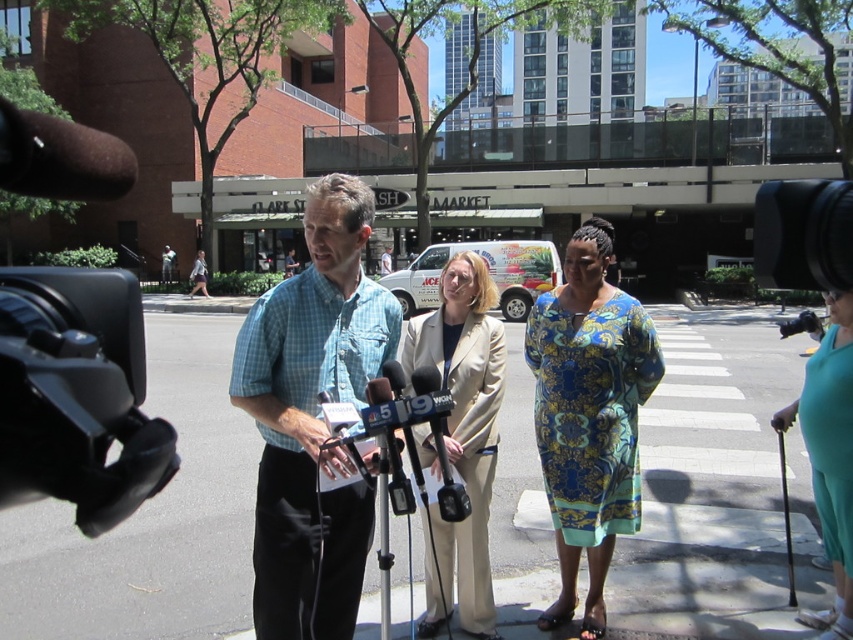
In the scene shown: You are a photographer at the press conference. You want to take a photo that includes both the light blue plaid shirt at center and the blue floral dress at center. Which one should you focus on to ensure the larger one is in sharp focus?

The light blue plaid shirt at center is larger than the blue floral dress at center, so you should focus on the light blue plaid shirt at center to ensure the larger one is in sharp focus.